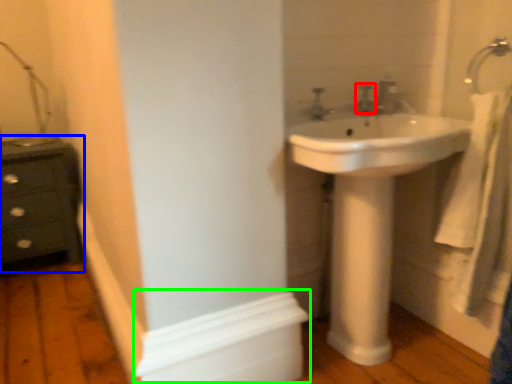
Question: Which is nearer to the plumbing fixture (highlighted by a red box)? chest of drawers (highlighted by a blue box) or molding (highlighted by a green box).

Choices:
 (A) chest of drawers
 (B) molding

Answer: (B)